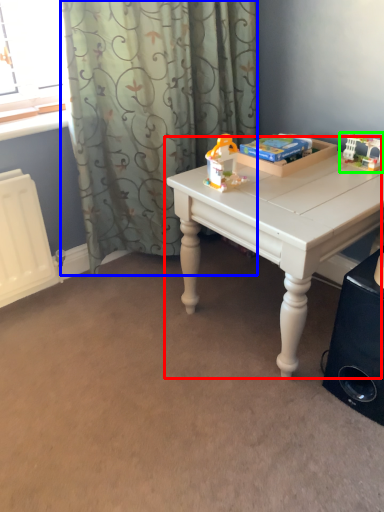
Question: Based on their relative distances, which object is nearer to table (highlighted by a red box)? Choose from curtain (highlighted by a blue box) and toy (highlighted by a green box).

Choices:
 (A) curtain
 (B) toy

Answer: (B)